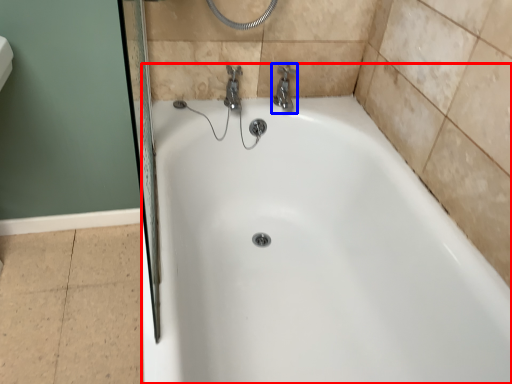
Question: Among these objects, which one is farthest to the camera, bathtub (highlighted by a red box) or tap (highlighted by a blue box)?

Choices:
 (A) bathtub
 (B) tap

Answer: (B)